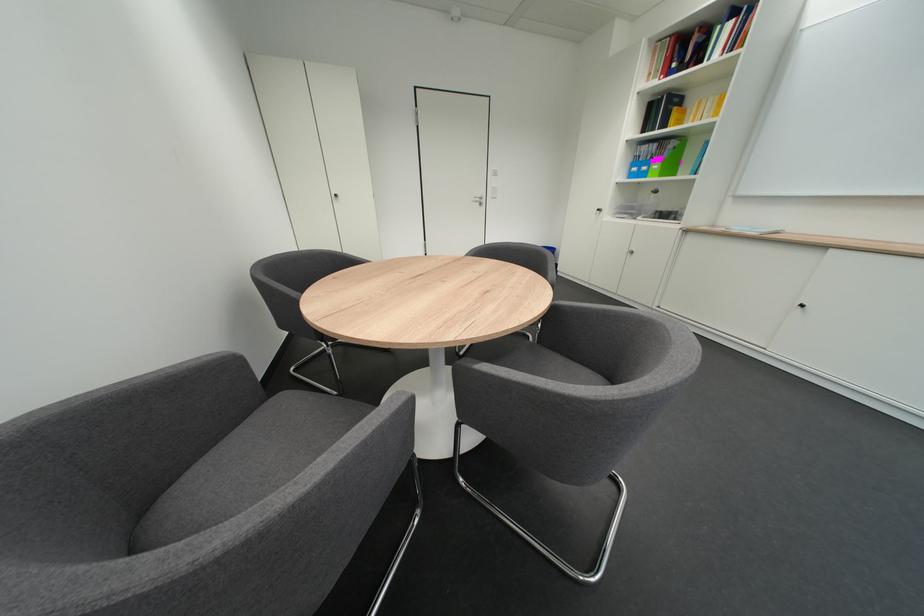
Find where to push the white light switch. Please return your answer as a coordinate pair (x, y).

(492, 192)